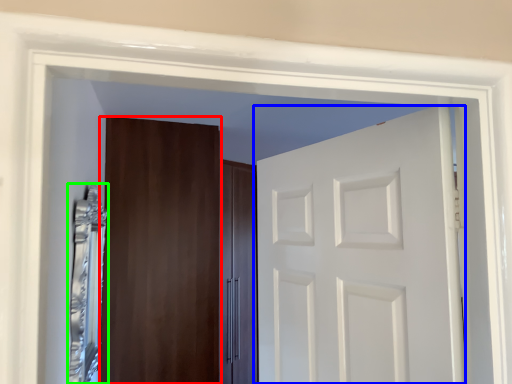
Question: Which object is the farthest from door (highlighted by a red box)? Choose among these: door (highlighted by a blue box) or mirror (highlighted by a green box).

Choices:
 (A) door
 (B) mirror

Answer: (A)